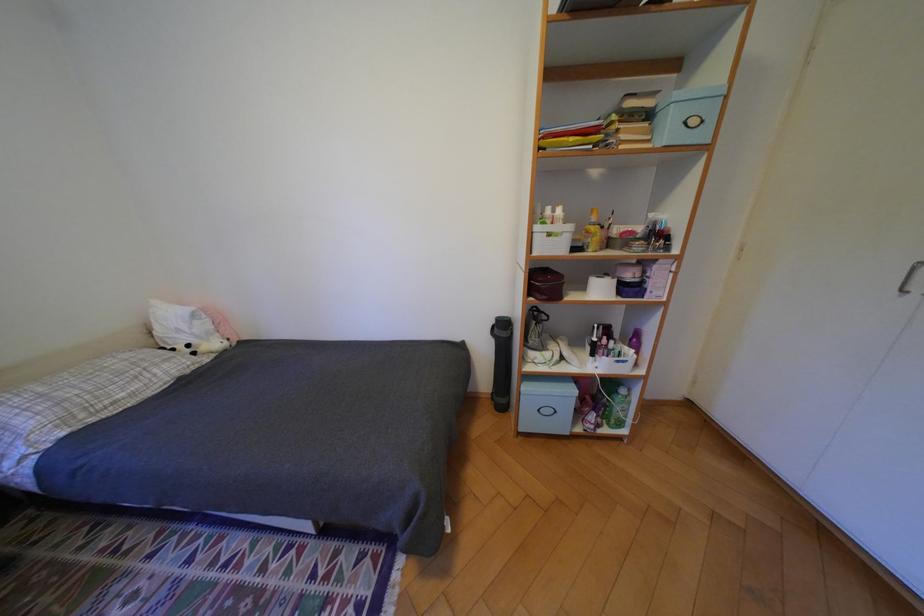
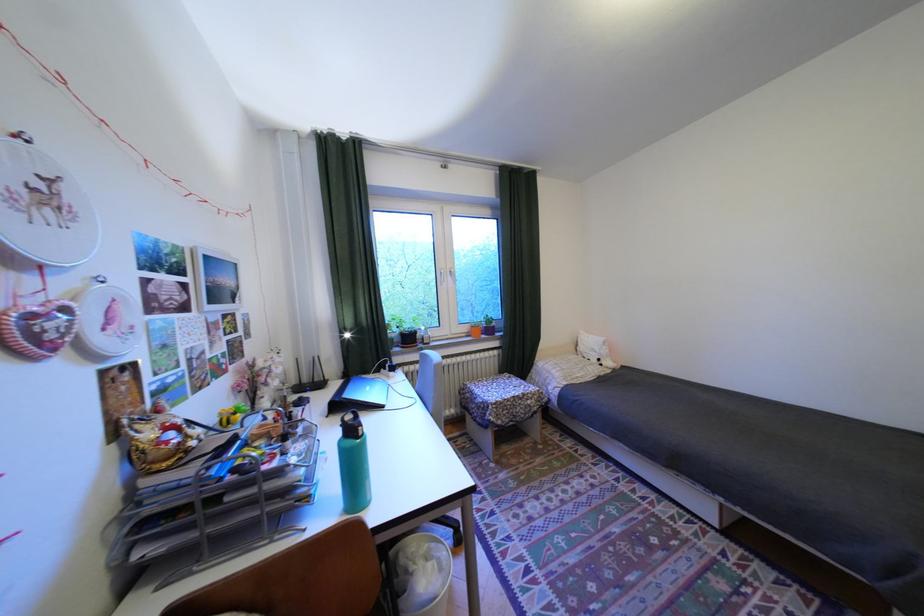
In the second image, find the point that corresponds to (x=201, y=346) in the first image.

(611, 360)